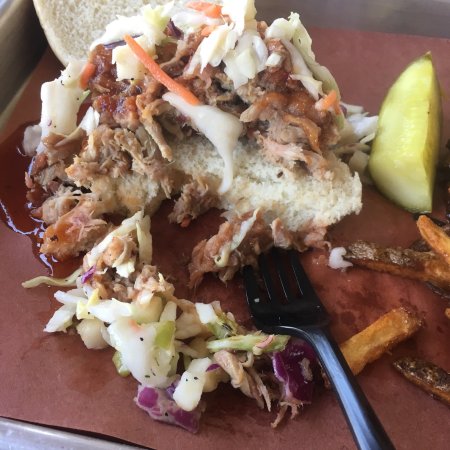
Where is `black fork`? Image resolution: width=450 pixels, height=450 pixels. black fork is located at coordinates (312, 309).